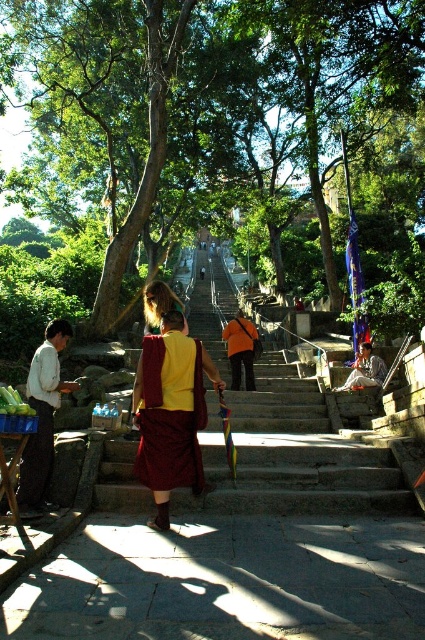
Consider the image. Is maroon silk robe at center closer to the viewer compared to maroon silk robe at left?

Yes, it is.

Can you confirm if maroon silk robe at center is bigger than maroon silk robe at left?

No, maroon silk robe at center is not bigger than maroon silk robe at left.

Is point (184, 474) positioned behind point (42, 371)?

No, it is not.

Where is `maroon silk robe at center`? Image resolution: width=425 pixels, height=640 pixels. maroon silk robe at center is located at coordinates point(170,417).

Does blonde hair at center appear on the right side of light brown wooden bench at center?

Incorrect, blonde hair at center is not on the right side of light brown wooden bench at center.

Is point (161, 316) more distant than point (362, 362)?

No, it is in front of (362, 362).

Locate an element on the screen. blonde hair at center is located at coordinates (158, 305).

Is maroon silk robe at left bigger than blonde hair at center?

No, maroon silk robe at left is not bigger than blonde hair at center.

Which is more to the right, maroon silk robe at left or blonde hair at center?

Positioned to the right is blonde hair at center.

Between point (30, 484) and point (170, 291), which one is positioned behind?

Positioned behind is point (170, 291).

Locate an element on the screen. Image resolution: width=425 pixels, height=640 pixels. maroon silk robe at left is located at coordinates (40, 422).